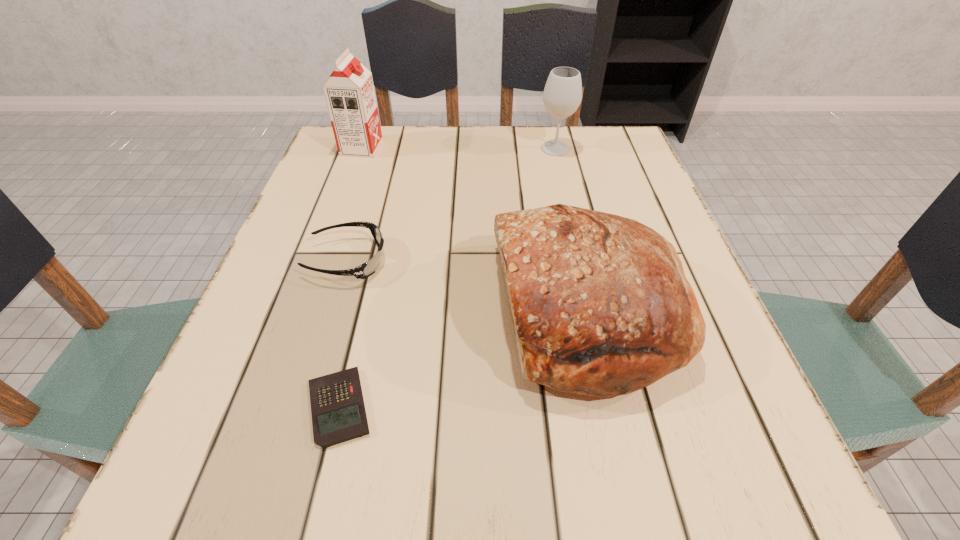
Where is `free spot between the bread and the fourth tallest object`? free spot between the bread and the fourth tallest object is located at coordinates (468, 286).

You are a GUI agent. You are given a task and a screenshot of the screen. Output one action in this format:
    pyautogui.click(x=<x>, y=<y>)
    Task: Click on the empty location between the bread and the second shortest object
    The image size is (960, 540).
    Given the screenshot: What is the action you would take?
    pyautogui.click(x=468, y=286)

At what (x,y) coordinates should I click in order to perform the action: click on free point between the sunglasses and the shortest object. Please return your answer as a coordinate pair (x, y). The width and height of the screenshot is (960, 540). Looking at the image, I should click on (344, 334).

Image resolution: width=960 pixels, height=540 pixels. Find the location of `free space between the calculator and the sunglasses`. free space between the calculator and the sunglasses is located at coordinates (344, 334).

At what (x,y) coordinates should I click in order to perform the action: click on free space between the soya milk and the wineglass. Please return your answer as a coordinate pair (x, y). The image size is (960, 540). Looking at the image, I should click on (459, 148).

Identify which object is located as the nearest to the sunglasses. Please provide its 2D coordinates. Your answer should be formatted as a tuple, i.e. [(x, y)], where the tuple contains the x and y coordinates of a point satisfying the conditions above.

[(338, 412)]

Locate which object ranks third in proximity to the calculator. Please provide its 2D coordinates. Your answer should be formatted as a tuple, i.e. [(x, y)], where the tuple contains the x and y coordinates of a point satisfying the conditions above.

[(349, 92)]

The height and width of the screenshot is (540, 960). Find the location of `vacant region that satisfies the following two spatial constraints: 1. on the front side of the shortest object; 2. on the right side of the tallest object`. vacant region that satisfies the following two spatial constraints: 1. on the front side of the shortest object; 2. on the right side of the tallest object is located at coordinates (268, 407).